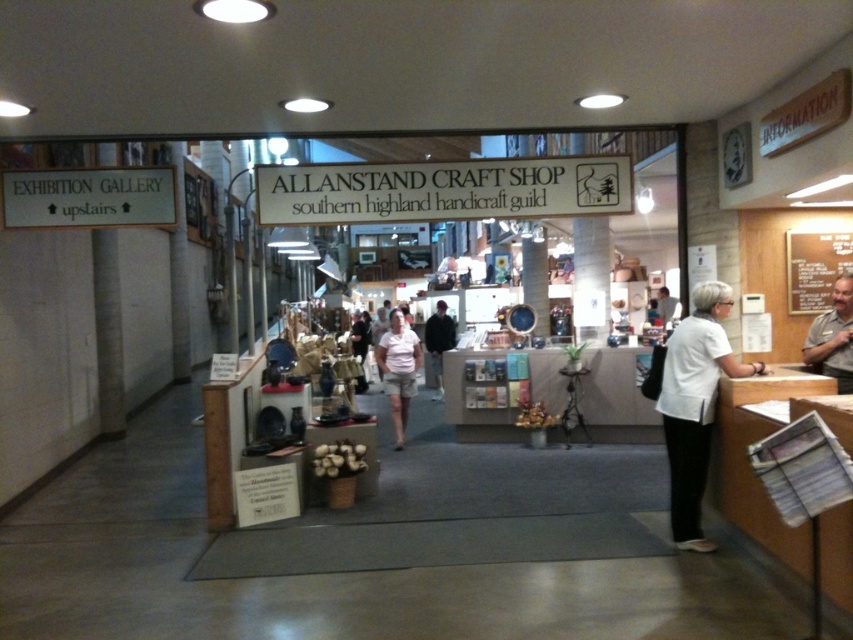
Between white fabric shirt at center and black cotton shirt at center, which one is positioned higher?

black cotton shirt at center is above.

Who is more distant from viewer, (669, 512) or (445, 308)?

The point (445, 308) is more distant.

Who is more distant from viewer, (683,486) or (428,332)?

The point (428,332) is more distant.

Locate an element on the screen. white fabric shirt at center is located at coordinates (695, 404).

Measure the distance between white fabric shirt at center and camera.

The distance of white fabric shirt at center from camera is 14.83 feet.

Who is positioned more to the left, white fabric shirt at center or pink fabric shirt at center?

Positioned to the left is pink fabric shirt at center.

Does point (679, 410) lie in front of point (383, 388)?

That is True.

Where is `white fabric shirt at center`? Image resolution: width=853 pixels, height=640 pixels. white fabric shirt at center is located at coordinates (695, 404).

Who is taller, pink fabric shirt at center or black cotton shirt at center?

black cotton shirt at center is taller.

Between pink fabric shirt at center and black cotton shirt at center, which one is positioned higher?

Positioned higher is black cotton shirt at center.

At what (x,y) coordinates should I click in order to perform the action: click on pink fabric shirt at center. Please return your answer as a coordinate pair (x, y). Looking at the image, I should click on (398, 369).